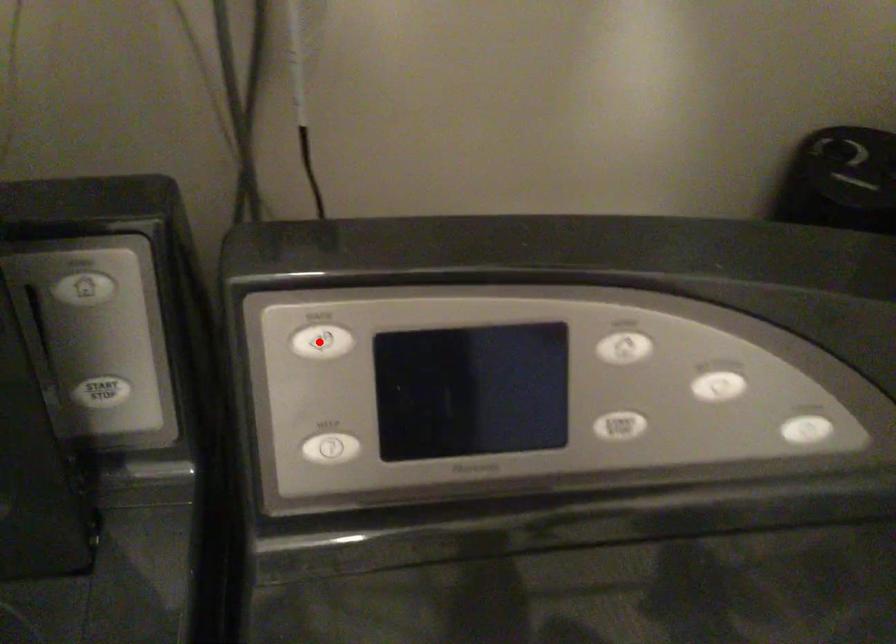
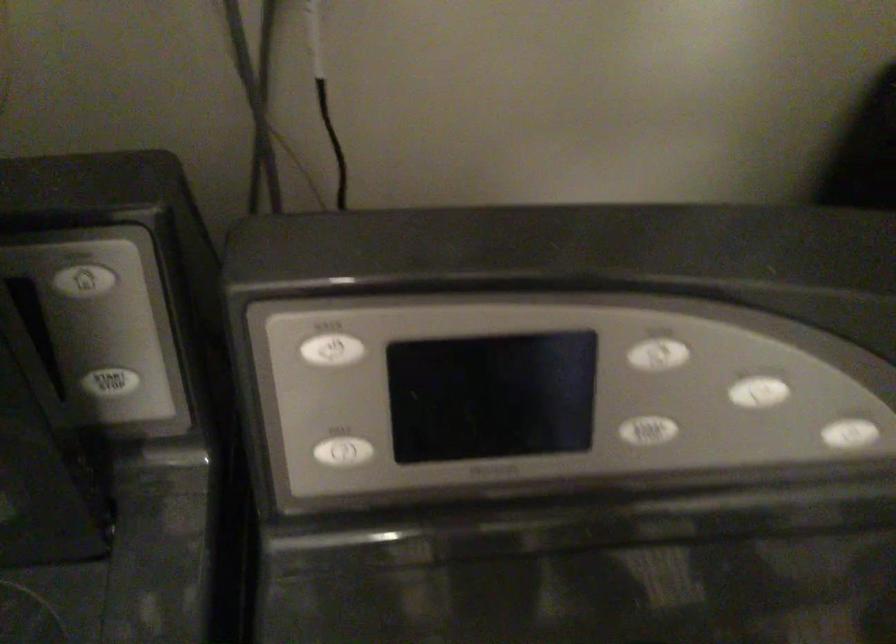
In the second image, find the point that corresponds to the highlighted location in the first image.

(332, 350)